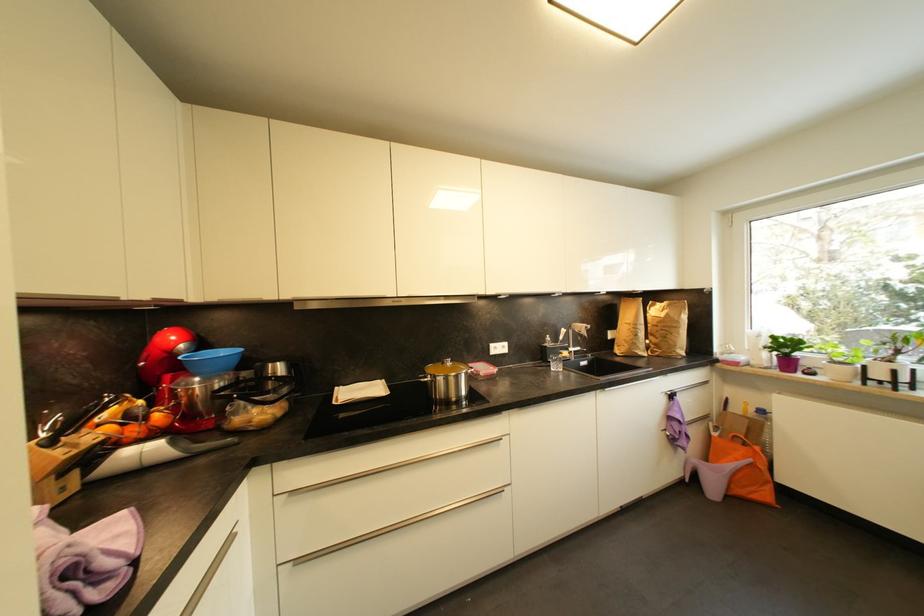
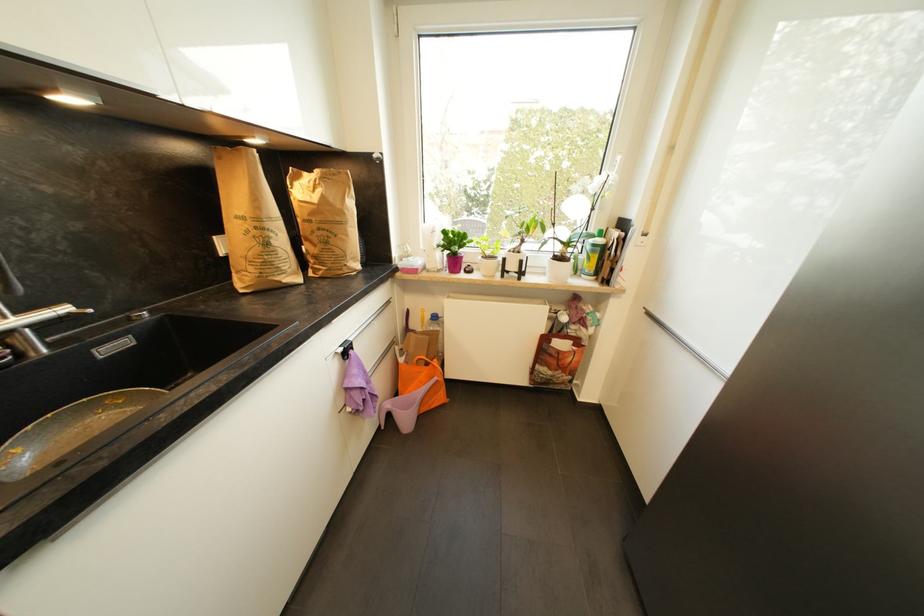
The point at [771,496] is marked in the first image. Where is the corresponding point in the second image?

(445, 399)